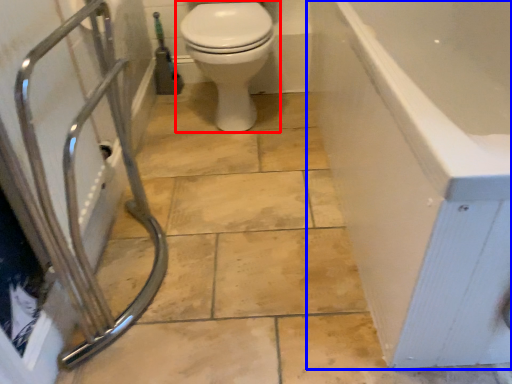
Question: Which of the following is the farthest to the observer, toilet (highlighted by a red box) or bathtub (highlighted by a blue box)?

Choices:
 (A) toilet
 (B) bathtub

Answer: (A)